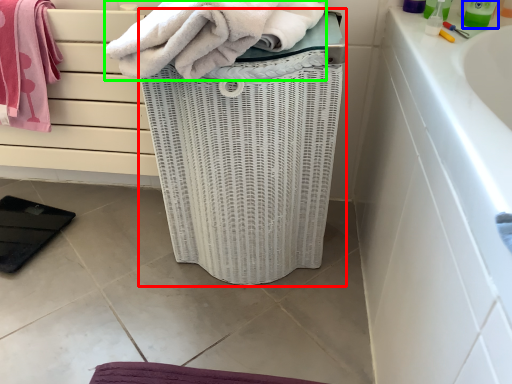
Question: Estimate the real-world distances between objects in this image. Which object is closer to basket container (highlighted by a red box), cleaning product (highlighted by a blue box) or towel (highlighted by a green box)?

Choices:
 (A) cleaning product
 (B) towel

Answer: (B)